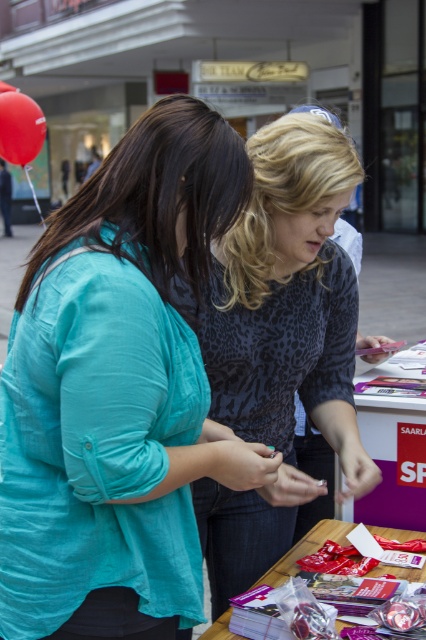
You are standing at the back of the event venue and want to approach the teal fabric shirt at center and leopard print blouse at center. Which one should you walk towards first to reach them in order?

You should first walk towards the teal fabric shirt at center because it is closer to you than the leopard print blouse at center.

You are organizing a small event and need to place a 3ft wide banner between the matte plastic table at center and the matte plastic table at lower center. Can the banner fit between them based on their widths?

The matte plastic table at center is narrower than the matte plastic table at lower center. However, the banner requires space between them, not their widths. The description only provides their widths, not the distance between them. Therefore, it is impossible to determine if the banner will fit based on the given information.

Consider the image. You are at an outdoor event and need to place a large poster on the ground near the table. Which table should you choose between the matte plastic table at center and the matte plastic table at lower center to ensure the poster is placed correctly?

The matte plastic table at lower center is located lower than the matte plastic table at center, so placing the poster on the ground near the matte plastic table at lower center would be more appropriate as it is positioned lower.